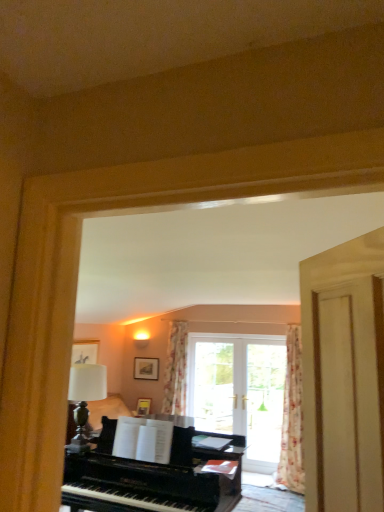
Looking at this image, in order to face floral fabric curtain at right, which ranks as the second curtain in back-to-front order, should I rotate leftwards or rightwards?

Turn right approximately 13.614 degrees to face it.

You are a GUI agent. You are given a task and a screenshot of the screen. Output one action in this format:
    pyautogui.click(x=<x>, y=<y>)
    Task: Click on the transparent glass door at center
    
    Given the screenshot: What is the action you would take?
    pyautogui.click(x=264, y=404)

What do you see at coordinates (155, 476) in the screenshot? This screenshot has height=512, width=384. I see `black polished piano at center` at bounding box center [155, 476].

What is the approximate width of black polished piano at center?

black polished piano at center is 1.85 meters wide.

The width and height of the screenshot is (384, 512). What do you see at coordinates (176, 369) in the screenshot? I see `floral fabric curtain at center, which appears as the first curtain when viewed from the left` at bounding box center [176, 369].

In order to face wooden picture frame at center, the 2th picture frame positioned from the back, should I rotate leftwards or rightwards?

It's best to rotate left around 6.551 degrees.

Find the location of a particular element. Image resolution: width=384 pixels, height=512 pixels. wooden picture frame at center, positioned as the first picture frame in bottom-to-top order is located at coordinates (143, 406).

Locate an element on the screen. floral fabric curtain at right, the 1th curtain in the front-to-back sequence is located at coordinates (292, 417).

Is there a large distance between transparent glass door at center and matte black picture frame at center, positioned as the 2th picture frame in front-to-back order?

Yes, transparent glass door at center and matte black picture frame at center, positioned as the 2th picture frame in front-to-back order, are located far from each other.

Is transparent glass door at center further to camera compared to matte black picture frame at center, placed as the first picture frame when sorted from back to front?

No.

Is transparent glass door at center facing away from matte black picture frame at center, acting as the second picture frame starting from the bottom?

transparent glass door at center does not have its back to matte black picture frame at center, acting as the second picture frame starting from the bottom.

Is transparent glass door at center thinner than matte black picture frame at center, placed as the first picture frame when sorted from back to front?

Incorrect, the width of transparent glass door at center is not less than that of matte black picture frame at center, placed as the first picture frame when sorted from back to front.

Can you confirm if transparent glass door at center is bigger than floral fabric curtain at right, which is the second curtain from left to right?

No.

Based on the photo, which object is positioned more to the right, transparent glass door at center or floral fabric curtain at right, the 1th curtain in the front-to-back sequence?

floral fabric curtain at right, the 1th curtain in the front-to-back sequence.

Considering the sizes of objects transparent glass door at center and floral fabric curtain at right, the 1th curtain in the front-to-back sequence, in the image provided, who is shorter, transparent glass door at center or floral fabric curtain at right, the 1th curtain in the front-to-back sequence,?

transparent glass door at center.

Considering the relative positions of transparent glass door at center and floral fabric curtain at right, the 1th curtain viewed from the right, in the image provided, is transparent glass door at center behind floral fabric curtain at right, the 1th curtain viewed from the right,?

Yes, transparent glass door at center is behind floral fabric curtain at right, the 1th curtain viewed from the right.

Locate an element on the screen. This screenshot has height=512, width=384. screen door that is in front of the matte black picture frame at center, positioned as the 2th picture frame in front-to-back order is located at coordinates (264, 404).

Is point (149, 359) closer to camera compared to point (246, 468)?

No.

In the scene shown: Could you tell me if matte black picture frame at center, the first picture frame positioned from the top, is facing transparent glass door at center?

No, matte black picture frame at center, the first picture frame positioned from the top, is not oriented towards transparent glass door at center.

Which object is wider, matte black picture frame at center, positioned as the 2th picture frame in front-to-back order, or transparent glass door at center?

Answer: With larger width is transparent glass door at center.

Considering the sizes of wooden picture frame at center, which appears as the 2th picture frame when viewed from the top, and transparent glass door at center in the image, is wooden picture frame at center, which appears as the 2th picture frame when viewed from the top, taller or shorter than transparent glass door at center?

Clearly, wooden picture frame at center, which appears as the 2th picture frame when viewed from the top, is shorter compared to transparent glass door at center.

From the image's perspective, between wooden picture frame at center, which is the first picture frame in front-to-back order, and transparent glass door at center, which one is located above?

transparent glass door at center.

From a real-world perspective, is wooden picture frame at center, positioned as the first picture frame in bottom-to-top order, on top of transparent glass door at center?

No, from a real-world perspective, wooden picture frame at center, positioned as the first picture frame in bottom-to-top order, is not over transparent glass door at center

Could you tell me if wooden picture frame at center, positioned as the first picture frame in bottom-to-top order, is turned towards transparent glass door at center?

No, wooden picture frame at center, positioned as the first picture frame in bottom-to-top order, does not turn towards transparent glass door at center.

Could transparent glass door at center be considered to be inside floral fabric curtain at right, the 1th curtain viewed from the right?

No, transparent glass door at center is not a part of floral fabric curtain at right, the 1th curtain viewed from the right.

Which is in front, floral fabric curtain at right, which ranks as the second curtain in back-to-front order, or transparent glass door at center?

floral fabric curtain at right, which ranks as the second curtain in back-to-front order.

From their relative heights in the image, would you say floral fabric curtain at right, the 1th curtain viewed from the right, is taller or shorter than transparent glass door at center?

Clearly, floral fabric curtain at right, the 1th curtain viewed from the right, is taller compared to transparent glass door at center.

Locate an element on the screen. This screenshot has height=512, width=384. the 1st curtain above the transparent glass door at center (from the image's perspective) is located at coordinates (292, 417).

Which is in front, floral fabric curtain at right, the 1th curtain viewed from the right, or black polished piano at center?

Positioned in front is black polished piano at center.

Is point (299, 488) closer or farther from the camera than point (206, 458)?

Point (299, 488) is farther from the camera than point (206, 458).

Between floral fabric curtain at right, the 1th curtain viewed from the right, and black polished piano at center, which one has more height?

floral fabric curtain at right, the 1th curtain viewed from the right.

Is floral fabric curtain at right, which ranks as the second curtain in back-to-front order, thinner than black polished piano at center?

Yes.

Which object is more forward, floral fabric curtain at center, marked as the 2th curtain in a right-to-left arrangement, or transparent glass door at center?

transparent glass door at center is more forward.

Can you see floral fabric curtain at center, the second curtain positioned from the front, touching transparent glass door at center?

floral fabric curtain at center, the second curtain positioned from the front, is not next to transparent glass door at center, and they're not touching.

From a real-world perspective, relative to transparent glass door at center, is floral fabric curtain at center, the 1th curtain when ordered from back to front, vertically above or below?

From a real-world perspective, floral fabric curtain at center, the 1th curtain when ordered from back to front, is physically above transparent glass door at center.

I want to click on screen door that is below the matte black picture frame at center, acting as the second picture frame starting from the bottom (from the image's perspective), so click(264, 404).

From the image's perspective, count 1st curtains upward from the transparent glass door at center and point to it. Please provide its 2D coordinates.

[(292, 417)]

Looking at the image, which one is located closer to floral fabric curtain at center, which appears as the first curtain when viewed from the left, black polished piano at center or transparent glass door at center?

transparent glass door at center is closer to floral fabric curtain at center, which appears as the first curtain when viewed from the left.

Estimate the real-world distances between objects in this image. Which object is closer to matte black picture frame at center, the first picture frame positioned from the top, floral fabric curtain at center, which appears as the first curtain when viewed from the left, or floral fabric curtain at right, the 1th curtain in the front-to-back sequence?

floral fabric curtain at center, which appears as the first curtain when viewed from the left.

Looking at this image, estimate the real-world distances between objects in this image. Which object is further from black polished piano at center, transparent glass door at center or floral fabric curtain at center, the second curtain positioned from the front?

The object further to black polished piano at center is floral fabric curtain at center, the second curtain positioned from the front.

Estimate the real-world distances between objects in this image. Which object is closer to transparent glass door at center, floral fabric curtain at right, which is the second curtain from left to right, or matte black picture frame at center, positioned as the 2th picture frame in front-to-back order?

floral fabric curtain at right, which is the second curtain from left to right, lies closer to transparent glass door at center than the other object.

Looking at the image, which one is located closer to wooden picture frame at center, which is the first picture frame in front-to-back order, black polished piano at center or floral fabric curtain at center, the 1th curtain when ordered from back to front?

floral fabric curtain at center, the 1th curtain when ordered from back to front, lies closer to wooden picture frame at center, which is the first picture frame in front-to-back order, than the other object.

Considering their positions, is matte black picture frame at center, the first picture frame positioned from the top, positioned further to black polished piano at center than floral fabric curtain at center, which appears as the first curtain when viewed from the left?

matte black picture frame at center, the first picture frame positioned from the top, is further to black polished piano at center.

Estimate the real-world distances between objects in this image. Which object is closer to wooden picture frame at center, positioned as the first picture frame in bottom-to-top order, floral fabric curtain at right, which is the second curtain from left to right, or black polished piano at center?

floral fabric curtain at right, which is the second curtain from left to right, is positioned closer to the anchor wooden picture frame at center, positioned as the first picture frame in bottom-to-top order.

Which object lies nearer to the anchor point floral fabric curtain at center, the second curtain positioned from the front, black polished piano at center or matte black picture frame at center, acting as the second picture frame starting from the bottom?

Based on the image, matte black picture frame at center, acting as the second picture frame starting from the bottom, appears to be nearer to floral fabric curtain at center, the second curtain positioned from the front.

The image size is (384, 512). I want to click on curtain situated between wooden picture frame at center, which is the first picture frame in front-to-back order, and floral fabric curtain at right, which is the second curtain from left to right, from left to right, so click(x=176, y=369).

Where is `picture frame situated between matte black picture frame at center, positioned as the 2th picture frame in front-to-back order, and transparent glass door at center from left to right`? picture frame situated between matte black picture frame at center, positioned as the 2th picture frame in front-to-back order, and transparent glass door at center from left to right is located at coordinates (143, 406).

Where is `curtain between black polished piano at center and floral fabric curtain at center, marked as the 2th curtain in a right-to-left arrangement, in the front-back direction`? Image resolution: width=384 pixels, height=512 pixels. curtain between black polished piano at center and floral fabric curtain at center, marked as the 2th curtain in a right-to-left arrangement, in the front-back direction is located at coordinates (292, 417).

Image resolution: width=384 pixels, height=512 pixels. What are the coordinates of `screen door between black polished piano at center and wooden picture frame at center, the 2th picture frame positioned from the back, in the front-back direction` in the screenshot? It's located at (264, 404).